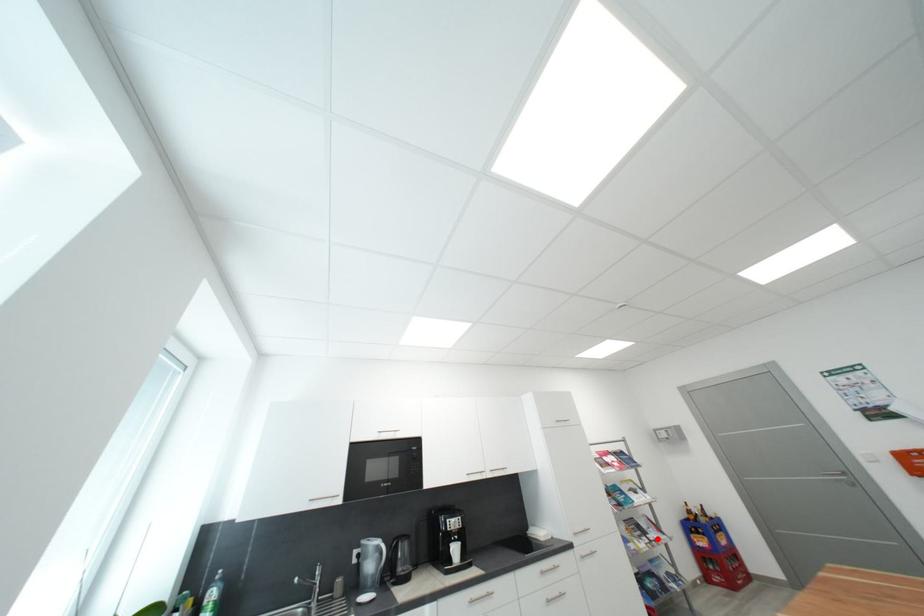
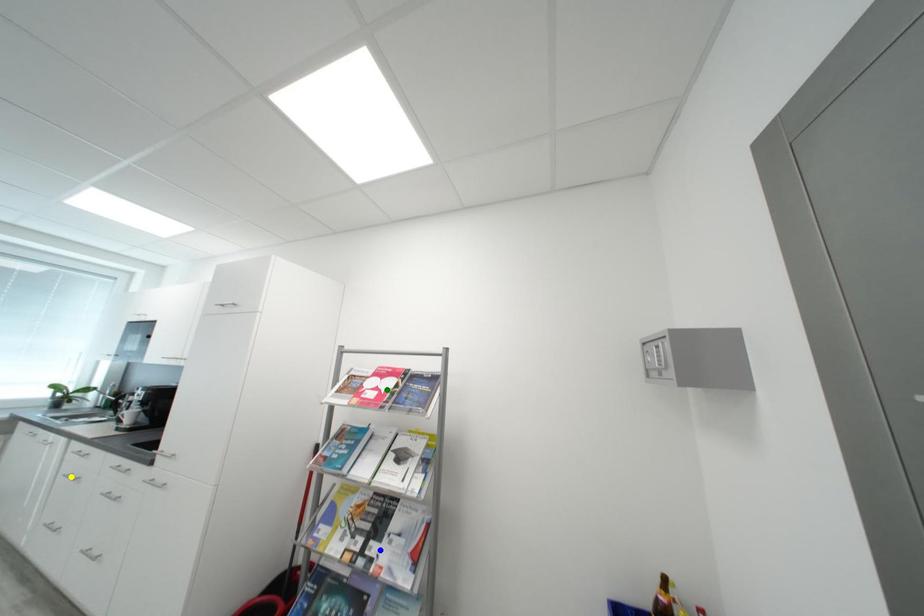
Question: I am providing you with two images of the same scene from different viewpoints. A red point is marked on the first image. You are given multiple points on the second image. Which mark in image 2 goes with the point in image 1?

Choices:
 (A) yellow point
 (B) blue point
 (C) green point

Answer: (B)